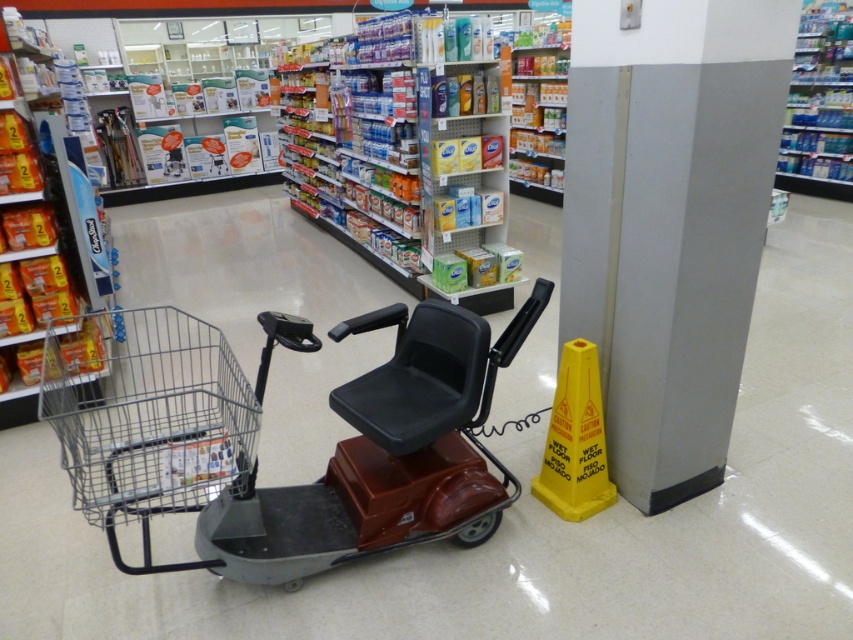
You are a customer in the store and want to reach the mobility scooter near the gray smooth pillar at right. You are currently standing next to the metallic gray shopping cart at center. Which direction should you move to get closer to the mobility scooter?

The metallic gray shopping cart at center is behind the gray smooth pillar at right, so to reach the mobility scooter near the gray smooth pillar at right, you should move forward towards the pillar from behind it where the cart is located.

You are a customer in the store and want to place a large box on the floor between the gray smooth pillar at right and the metallic gray shopping cart at center. Considering their heights, will the box be visible from above once placed there?

The gray smooth pillar at right is much taller than the metallic gray shopping cart at center. Since the pillar is taller, it might block the view of the box from above, making it less visible depending on the angle.